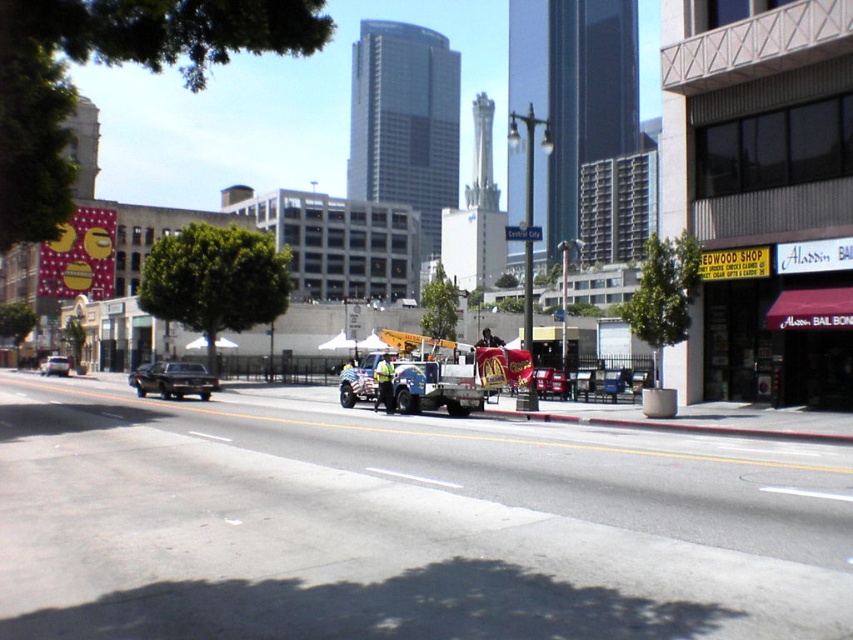
You are a delivery driver who needs to park your vehicle in this urban area. There is a metallic blue tow truck at center located at point [433,374]. Is there enough space to park your vehicle between the metallic blue tow truck at center and the nearest building? Please provide your reasoning based on the scene description.

The scene description mentions that the metallic blue tow truck at center is located at point [433,374], but does not provide specific distance measurements between the tow truck and the nearest building. Without this information, it is impossible to determine if there is sufficient space to park between them.